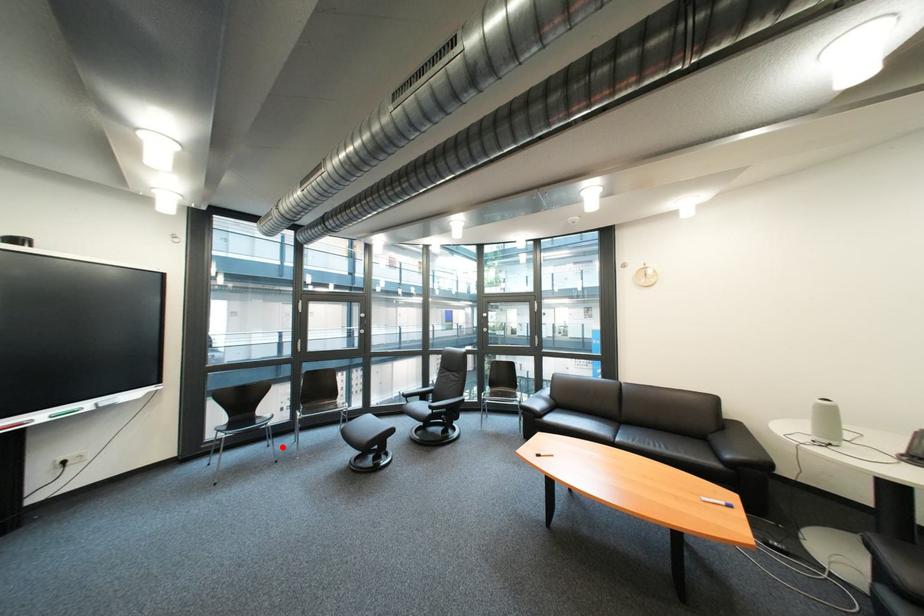
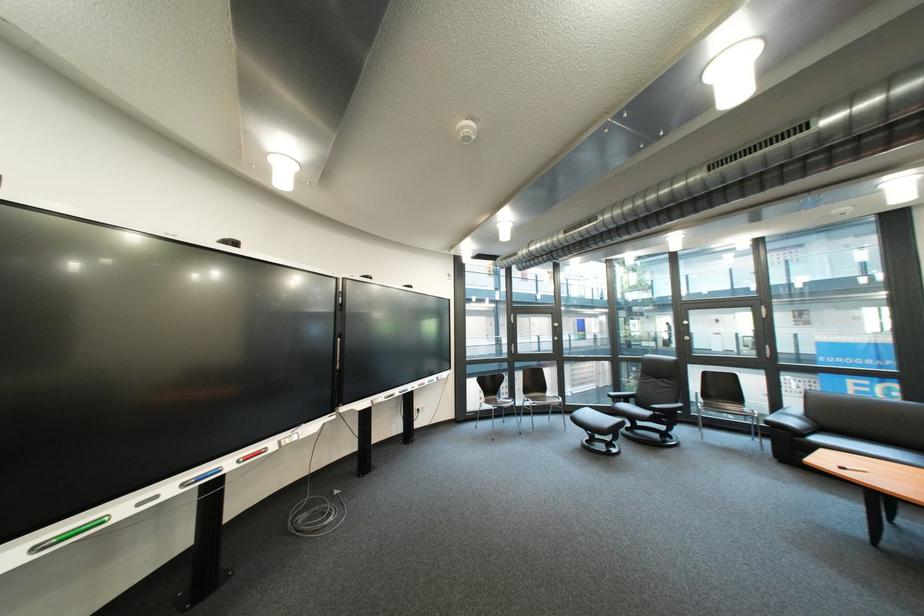
Where in the second image is the point corresponding to the highlighted location from the first image?

(517, 424)